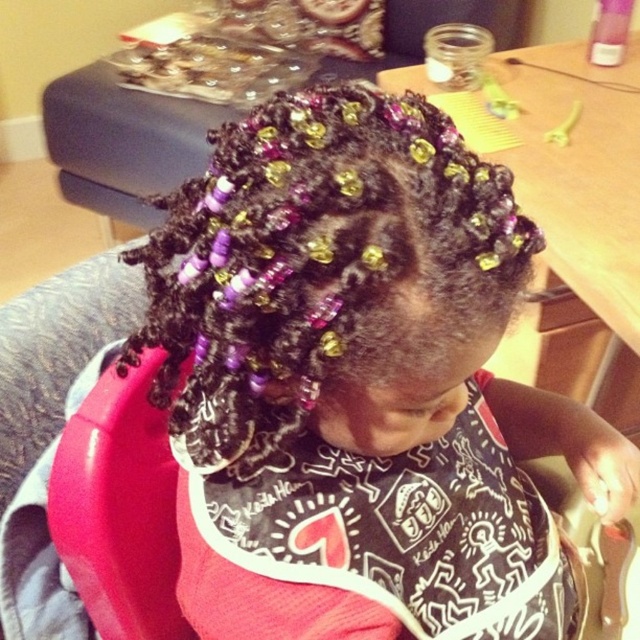
Question: Is purple beaded hair at center in front of black printed bib at center?

Choices:
 (A) no
 (B) yes

Answer: (B)

Question: Does purple beaded hair at center have a greater width compared to black printed bib at center?

Choices:
 (A) yes
 (B) no

Answer: (B)

Question: Which point is farther to the camera?

Choices:
 (A) purple beaded hair at center
 (B) black printed bib at center

Answer: (B)

Question: Considering the relative positions of purple beaded hair at center and black printed bib at center in the image provided, where is purple beaded hair at center located with respect to black printed bib at center?

Choices:
 (A) right
 (B) left

Answer: (B)

Question: Which point is farther to the camera?

Choices:
 (A) (408, 618)
 (B) (269, 332)

Answer: (A)